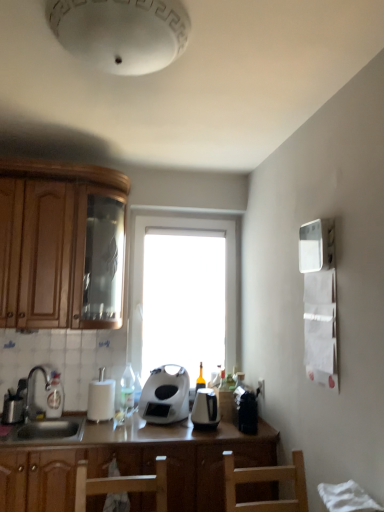
Identify the location of vacant space that is in between white matte paper towel holder at center and translucent glass bottle at sink left, marked as the 2th bottle in a right-to-left arrangement. (71, 418).